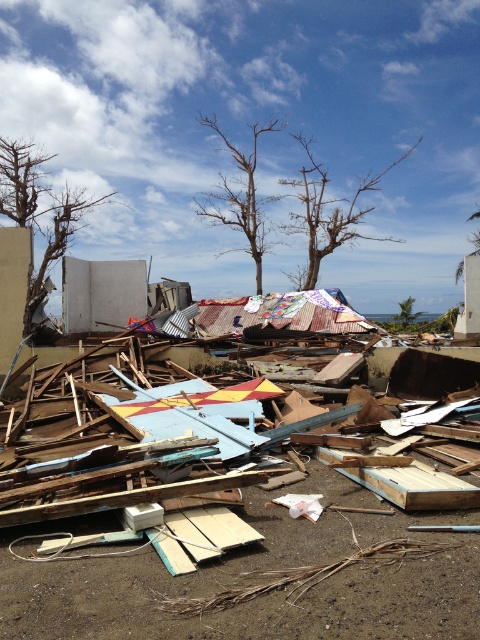
Based on the scene description, where exactly is the bare branches at center located in terms of coordinates?

The bare branches at center is located at point (475, 243).